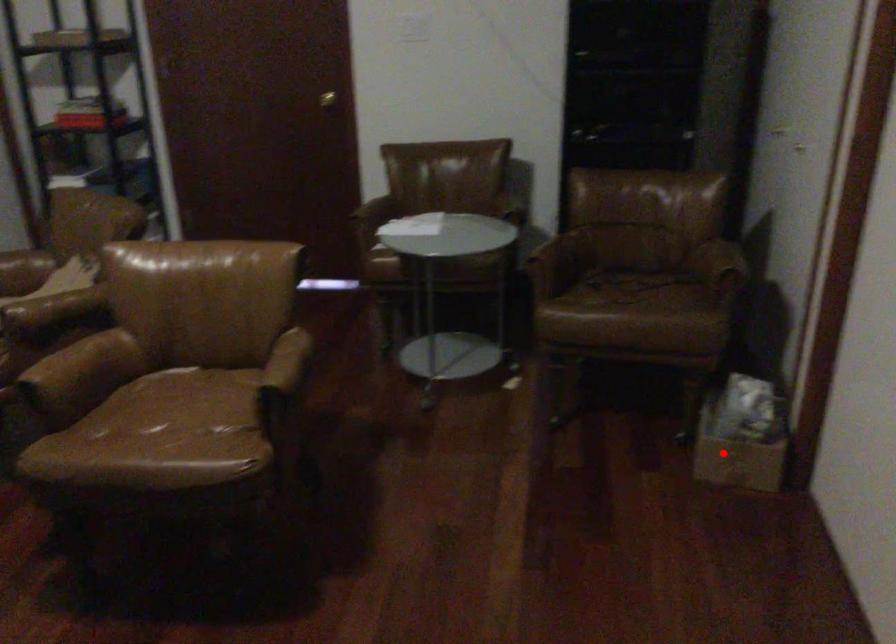
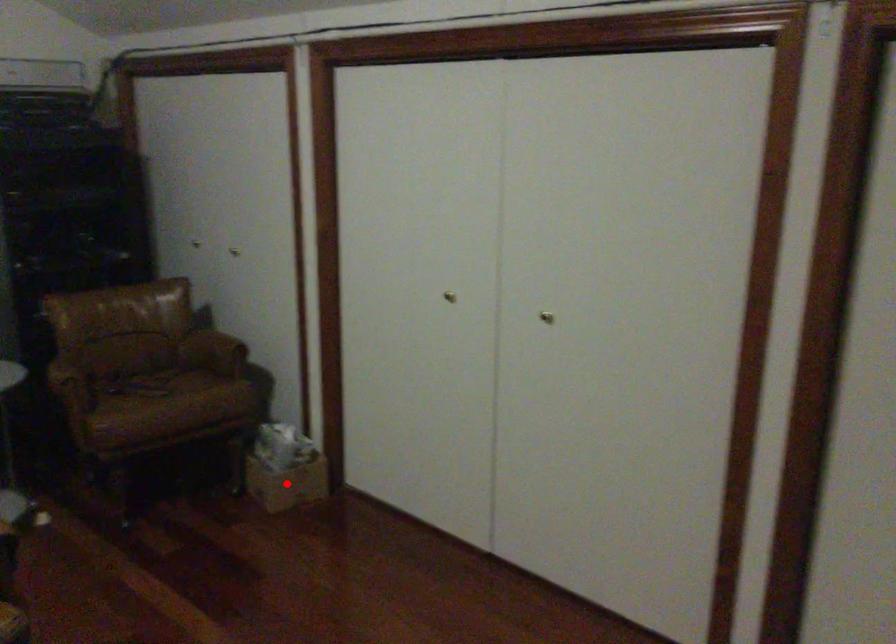
Consider the image. I am providing you with two images of the same scene from different viewpoints. A red point is marked on the first image and another point is marked on the second image. Is the red point in image1 aligned with the point shown in image2?

Yes